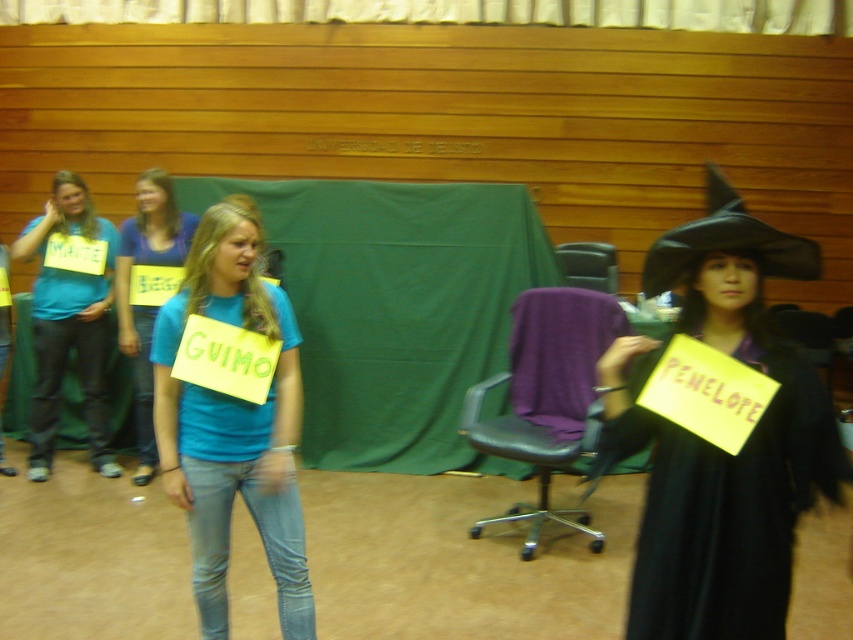
Question: Is the position of purple leather chair at center more distant than that of black felt witch hat at upper right?

Choices:
 (A) yes
 (B) no

Answer: (A)

Question: Does black matte witch hat at upper right appear on the left side of black leather chair at center?

Choices:
 (A) no
 (B) yes

Answer: (B)

Question: Which point is farther from the camera taking this photo?

Choices:
 (A) (535, 307)
 (B) (599, 253)
 (C) (669, 278)
 (D) (134, 253)

Answer: (B)

Question: Which object is closer to the camera taking this photo?

Choices:
 (A) matte blue shirt at left
 (B) blue cotton shirt at center
 (C) black leather chair at center
 (D) matte blue shirt at center

Answer: (B)

Question: Which point is closer to the camera?

Choices:
 (A) black leather chair at center
 (B) purple leather chair at center
 (C) blue cotton shirt at center

Answer: (C)

Question: Can you confirm if purple leather chair at center is positioned to the right of matte blue shirt at center?

Choices:
 (A) no
 (B) yes

Answer: (B)